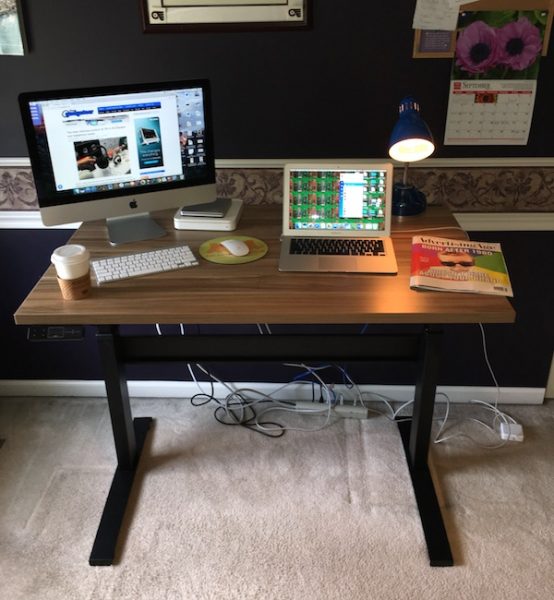
Find the location of a particular element. This screenshot has width=554, height=600. desk is located at coordinates (257, 323).